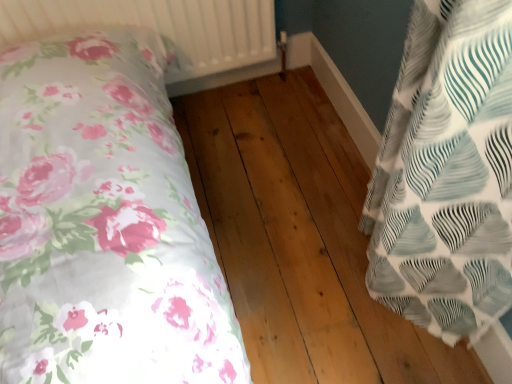
Image resolution: width=512 pixels, height=384 pixels. Describe the element at coordinates (300, 239) in the screenshot. I see `natural wood floor at center` at that location.

What do you see at coordinates (446, 173) in the screenshot?
I see `white textured fabric pillow at right` at bounding box center [446, 173].

Measure the distance between white textured radiator at upper center and camera.

white textured radiator at upper center and camera are 3.95 feet apart from each other.

In order to click on natural wood floor at center in this screenshot , I will do `click(300, 239)`.

Is white textured radiator at upper center positioned far away from natural wood floor at center?

No, there isn't a large distance between white textured radiator at upper center and natural wood floor at center.

Looking at this image, from a real-world perspective, which is physically below, white textured radiator at upper center or natural wood floor at center?

natural wood floor at center.

Measure the distance from white textured radiator at upper center to natural wood floor at center.

white textured radiator at upper center is 22.68 inches away from natural wood floor at center.

Is natural wood floor at center oriented towards white textured fabric pillow at right?

No, natural wood floor at center is not oriented towards white textured fabric pillow at right.

Are natural wood floor at center and white textured fabric pillow at right far apart?

natural wood floor at center is actually quite close to white textured fabric pillow at right.

Is natural wood floor at center surrounding white textured fabric pillow at right?

No, white textured fabric pillow at right is not inside natural wood floor at center.

Is natural wood floor at center positioned with its back to white textured radiator at upper center?

No, natural wood floor at center's orientation is not away from white textured radiator at upper center.

How many degrees apart are the facing directions of natural wood floor at center and white textured radiator at upper center?

0.576 degrees separate the facing orientations of natural wood floor at center and white textured radiator at upper center.

From the picture: Is natural wood floor at center outside of white textured radiator at upper center?

Yes.

From the image's perspective, is natural wood floor at center above or below white textured radiator at upper center?

From the image's perspective, natural wood floor at center appears below white textured radiator at upper center.

Is white textured fabric pillow at right turned away from natural wood floor at center?

No, natural wood floor at center is not at the back of white textured fabric pillow at right.

Between white textured fabric pillow at right and natural wood floor at center, which one has more height?

white textured fabric pillow at right.

From a real-world perspective, is white textured fabric pillow at right under natural wood floor at center?

No.

Which of these two, white textured fabric pillow at right or natural wood floor at center, is smaller?

Smaller between the two is white textured fabric pillow at right.

From a real-world perspective, between white textured radiator at upper center and white textured fabric pillow at right, who is vertically lower?

white textured fabric pillow at right is physically lower.

Are white textured radiator at upper center and white textured fabric pillow at right making contact?

No.

Measure the distance between white textured radiator at upper center and white textured fabric pillow at right.

white textured radiator at upper center is 38.44 inches from white textured fabric pillow at right.

From the image's perspective, is white textured radiator at upper center positioned above or below white textured fabric pillow at right?

white textured radiator at upper center is situated higher than white textured fabric pillow at right in the image.

Which is closer, (408,36) or (33,14)?

The point (408,36) is more forward.

Does white textured fabric pillow at right turn towards white textured radiator at upper center?

No, white textured fabric pillow at right is not oriented towards white textured radiator at upper center.

Looking at this image, from a real-world perspective, between white textured fabric pillow at right and white textured radiator at upper center, who is vertically lower?

white textured fabric pillow at right, from a real-world perspective.

Considering the sizes of objects white textured fabric pillow at right and white textured radiator at upper center in the image provided, who is bigger, white textured fabric pillow at right or white textured radiator at upper center?

With larger size is white textured radiator at upper center.

At what (x,y) coordinates should I click in order to perform the action: click on radiator that is above the natural wood floor at center (from the image's perspective). Please return your answer as a coordinate pair (x, y). Looking at the image, I should click on (160, 28).

Find the location of a particular element. hardwood that appears behind the white textured fabric pillow at right is located at coordinates pyautogui.click(x=300, y=239).

Estimate the real-world distances between objects in this image. Which object is closer to natural wood floor at center, white textured radiator at upper center or white textured fabric pillow at right?

The object closer to natural wood floor at center is white textured fabric pillow at right.

When comparing their distances from white textured radiator at upper center, does natural wood floor at center or white textured fabric pillow at right seem closer?

natural wood floor at center is positioned closer to the anchor white textured radiator at upper center.

Considering their positions, is white textured fabric pillow at right positioned closer to white textured radiator at upper center than natural wood floor at center?

Based on the image, natural wood floor at center appears to be nearer to white textured radiator at upper center.

Estimate the real-world distances between objects in this image. Which object is closer to white textured fabric pillow at right, natural wood floor at center or white textured radiator at upper center?

natural wood floor at center lies closer to white textured fabric pillow at right than the other object.

From the image, which object appears to be farther from white textured fabric pillow at right, white textured radiator at upper center or natural wood floor at center?

Based on the image, white textured radiator at upper center appears to be further to white textured fabric pillow at right.

Looking at this image, which object lies nearer to the anchor point natural wood floor at center, white textured fabric pillow at right or white textured radiator at upper center?

white textured fabric pillow at right lies closer to natural wood floor at center than the other object.

Image resolution: width=512 pixels, height=384 pixels. I want to click on hardwood between white textured radiator at upper center and white textured fabric pillow at right in the horizontal direction, so click(300, 239).